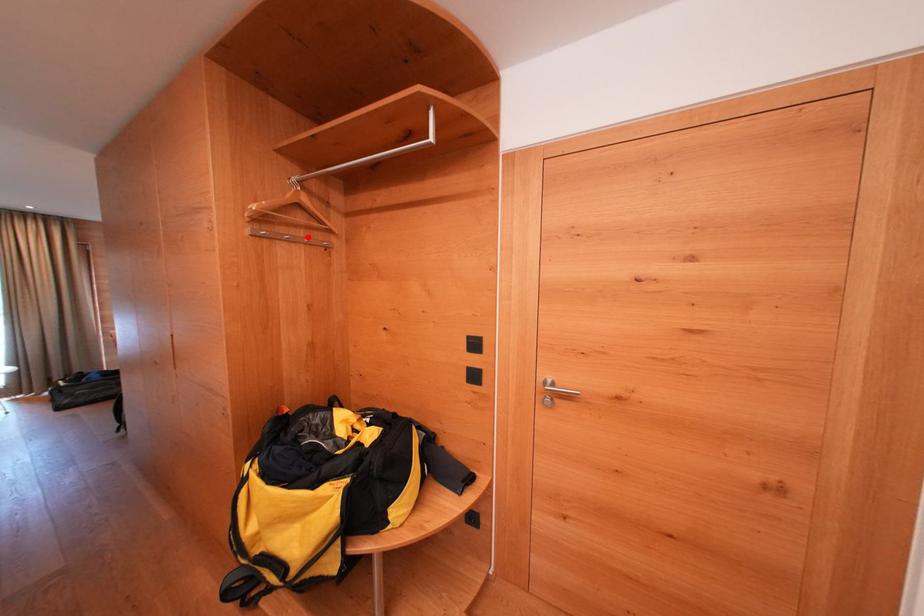
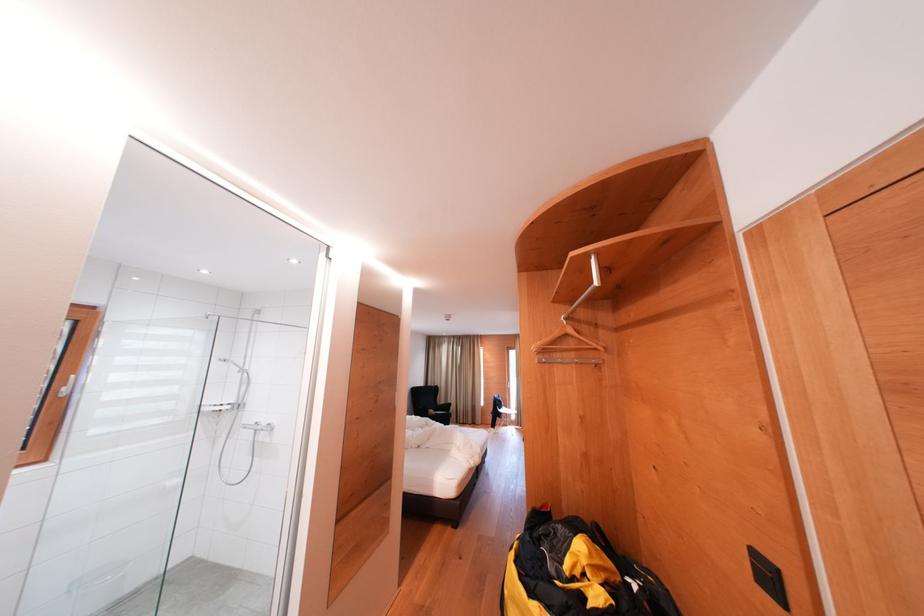
Question: I am providing you with two images of the same scene from different viewpoints. A red point is marked on the first image. At the location where the point appears in image 1, is it still visible in image 2?

Choices:
 (A) Yes
 (B) No

Answer: (A)